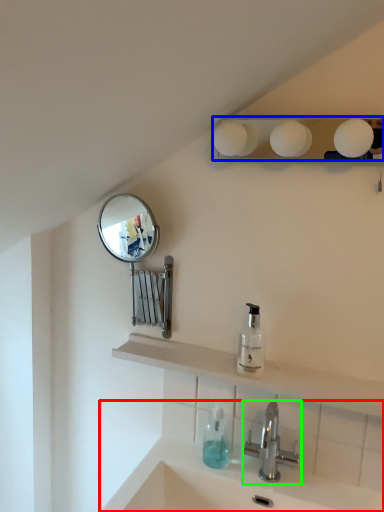
Question: Based on their relative distances, which object is farther from sink (highlighted by a red box)? Choose from lighting (highlighted by a blue box) and tap (highlighted by a green box).

Choices:
 (A) lighting
 (B) tap

Answer: (A)